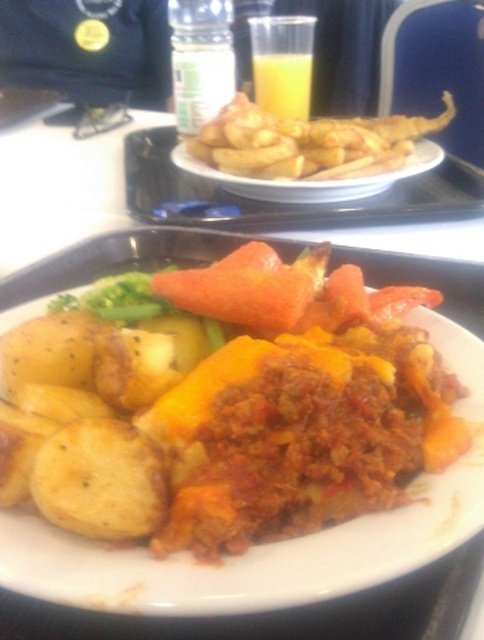
Can you confirm if yellow matte potatoes at lower left is taller than orange smooth carrot at center?

Yes.

Where is `yellow matte potatoes at lower left`? The height and width of the screenshot is (640, 484). yellow matte potatoes at lower left is located at coordinates click(x=224, y=404).

Where is `yellow matte potatoes at lower left`? The image size is (484, 640). yellow matte potatoes at lower left is located at coordinates (224, 404).

Between golden crispy fries at upper center and translucent plastic cup at upper center, which one has more height?

Standing taller between the two is golden crispy fries at upper center.

Is golden crispy fries at upper center smaller than translucent plastic cup at upper center?

Actually, golden crispy fries at upper center might be larger than translucent plastic cup at upper center.

Locate an element on the screen. The image size is (484, 640). golden crispy fries at upper center is located at coordinates (308, 141).

Is orange smooth carrot at center bigger than translucent plastic cup at upper center?

Yes, orange smooth carrot at center is bigger than translucent plastic cup at upper center.

Between orange smooth carrot at center and translucent plastic cup at upper center, which one appears on the left side from the viewer's perspective?

Positioned to the left is orange smooth carrot at center.

Which is behind, point (178, 284) or point (301, 93)?

The point (301, 93) is more distant.

Locate an element on the screen. The image size is (484, 640). orange smooth carrot at center is located at coordinates (247, 285).